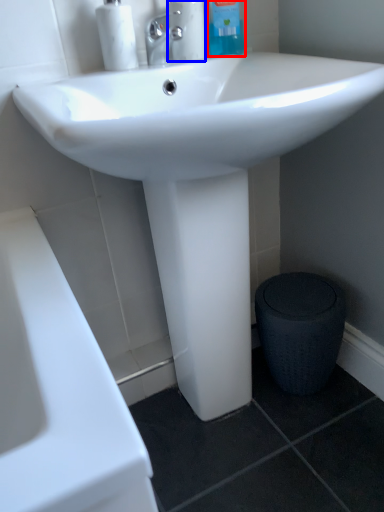
Question: Which object is closer to the camera taking this photo, cleaning product (highlighted by a red box) or cleaning product (highlighted by a blue box)?

Choices:
 (A) cleaning product
 (B) cleaning product

Answer: (B)